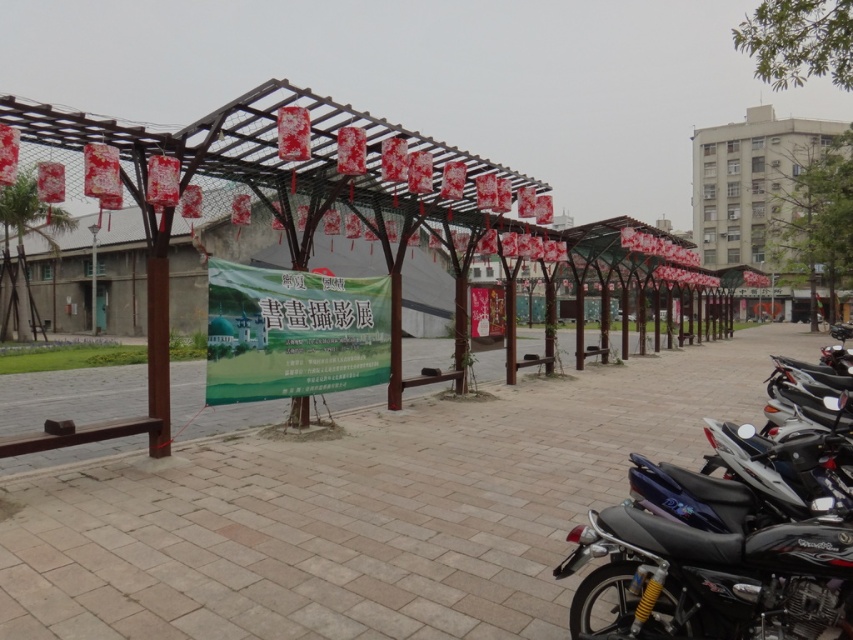
Question: Is black glossy motorcycle at right smaller than shiny black motorcycle at lower right?

Choices:
 (A) yes
 (B) no

Answer: (B)

Question: Can you confirm if black glossy motorcycle at right is positioned above shiny black motorcycle at lower right?

Choices:
 (A) no
 (B) yes

Answer: (B)

Question: Which of the following is the farthest from the observer?

Choices:
 (A) (675, 634)
 (B) (697, 572)

Answer: (A)

Question: Is black glossy motorcycle at right positioned in front of shiny black motorcycle at lower right?

Choices:
 (A) yes
 (B) no

Answer: (B)